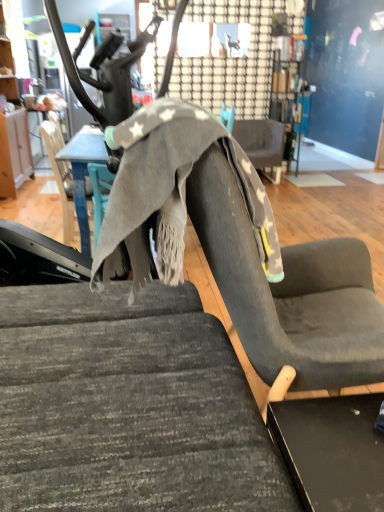
Question: In which direction should I rotate to look at gray fabric chair at center, the 1th chair in the back-to-front sequence?

Choices:
 (A) right
 (B) left

Answer: (A)

Question: Is wooden cabinet at left positioned in front of textured gray fabric chair at center, the second chair viewed from the left?

Choices:
 (A) no
 (B) yes

Answer: (A)

Question: From a real-world perspective, is wooden cabinet at left on textured gray fabric chair at center, which is the first chair in bottom-to-top order?

Choices:
 (A) yes
 (B) no

Answer: (A)

Question: Does wooden cabinet at left have a lesser height compared to textured gray fabric chair at center, the second chair viewed from the left?

Choices:
 (A) no
 (B) yes

Answer: (A)

Question: From a real-world perspective, does wooden cabinet at left sit lower than textured gray fabric chair at center, marked as the second chair in a right-to-left arrangement?

Choices:
 (A) no
 (B) yes

Answer: (A)

Question: Can you confirm if wooden cabinet at left is bigger than textured gray fabric chair at center, the first chair positioned from the front?

Choices:
 (A) yes
 (B) no

Answer: (B)

Question: Considering the relative sizes of wooden cabinet at left and textured gray fabric chair at center, the second chair viewed from the left, in the image provided, is wooden cabinet at left taller than textured gray fabric chair at center, the second chair viewed from the left,?

Choices:
 (A) no
 (B) yes

Answer: (B)

Question: Does gray fabric table at center have a larger size compared to gray fabric chair at center, the second chair when ordered from top to bottom?

Choices:
 (A) yes
 (B) no

Answer: (B)

Question: Can gray fabric chair at center, which appears as the 1th chair when viewed from the left, be found inside gray fabric table at center?

Choices:
 (A) yes
 (B) no

Answer: (B)

Question: Is gray fabric table at center thinner than gray fabric chair at center, marked as the 2th chair in a front-to-back arrangement?

Choices:
 (A) no
 (B) yes

Answer: (A)

Question: Is gray fabric table at center with gray fabric chair at center, which is the second chair from back to front?

Choices:
 (A) yes
 (B) no

Answer: (A)

Question: Can you confirm if gray fabric table at center is positioned to the left of gray fabric chair at center, marked as the 2th chair in a front-to-back arrangement?

Choices:
 (A) no
 (B) yes

Answer: (A)

Question: From a real-world perspective, does gray fabric table at center sit lower than gray fabric chair at center, marked as the 2th chair in a front-to-back arrangement?

Choices:
 (A) no
 (B) yes

Answer: (A)

Question: Is gray fabric chair at center, the 1th chair in the back-to-front sequence, outside of textured gray fabric swivel chair at center?

Choices:
 (A) no
 (B) yes

Answer: (B)